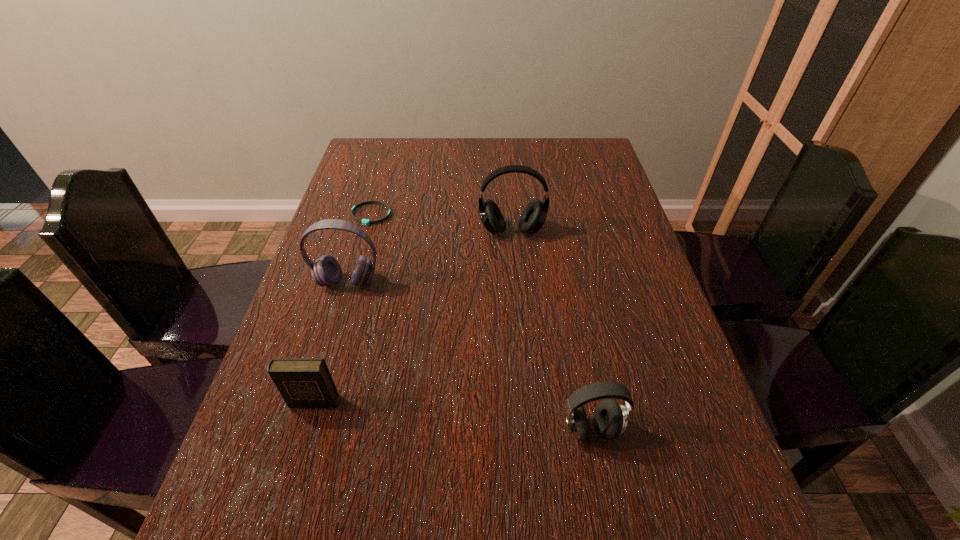
The height and width of the screenshot is (540, 960). I want to click on free space between the second nearest object and the shortest object, so click(x=342, y=308).

Locate an element on the screen. This screenshot has width=960, height=540. the fourth closest object relative to the second nearest object is located at coordinates (533, 217).

This screenshot has height=540, width=960. I want to click on the closest object to the shortest object, so click(x=326, y=271).

This screenshot has height=540, width=960. I want to click on headset that can be found as the second closest to the leftmost headset, so click(x=610, y=418).

This screenshot has width=960, height=540. Identify the location of headset that is the second closest one to the second nearest headset. (610, 418).